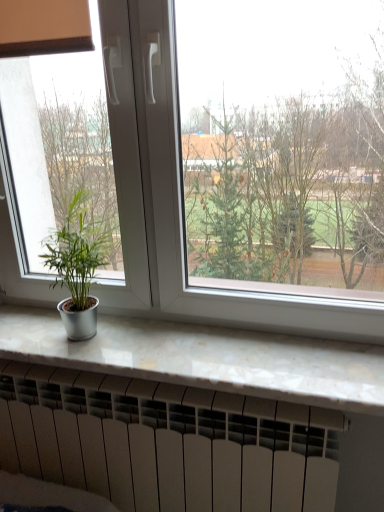
Image resolution: width=384 pixels, height=512 pixels. Identify the location of blank space situated above white marble counter top at lower center (from a real-world perspective). (152, 343).